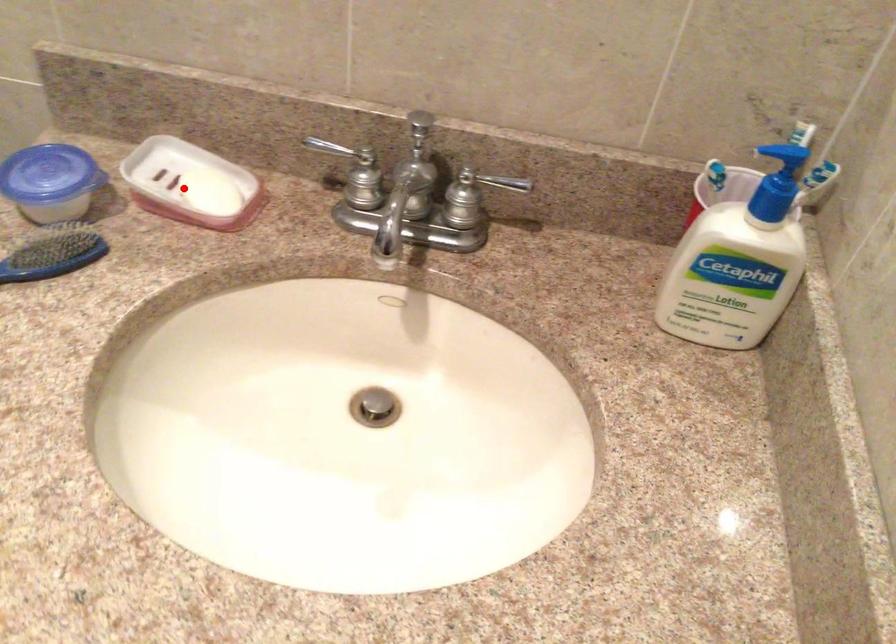
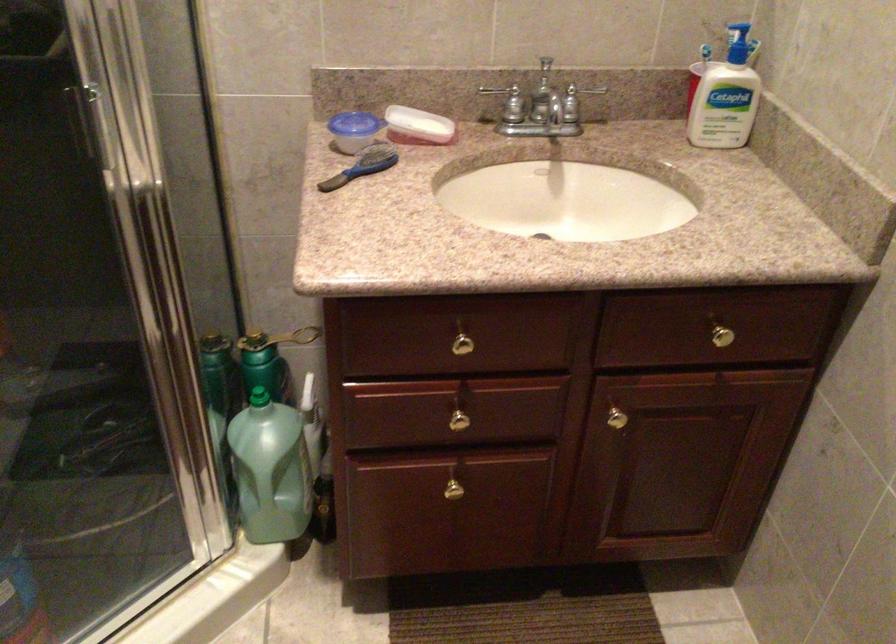
The point at the highlighted location is marked in the first image. Where is the corresponding point in the second image?

(418, 126)